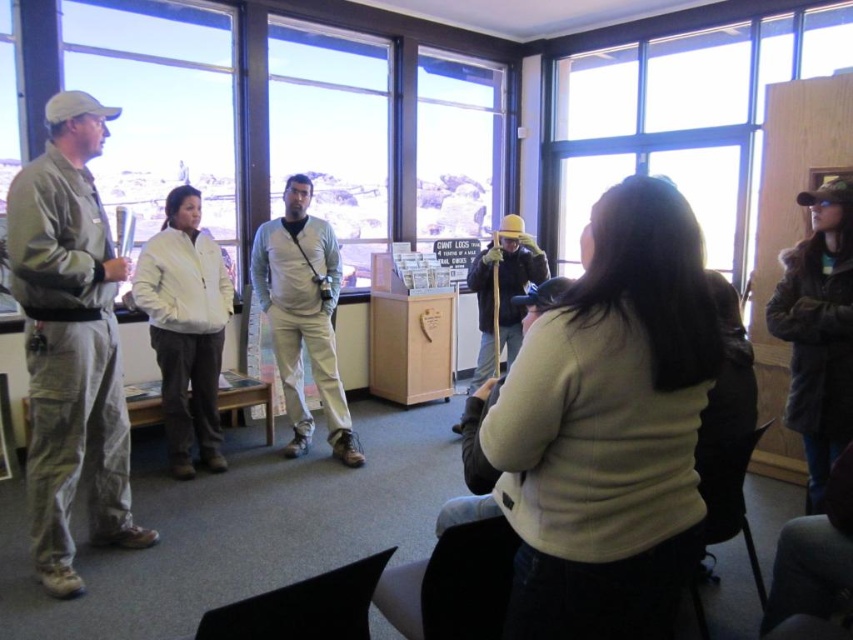
You are a person who is 1.8 meters tall and want to walk from the light beige sweater at center to the brown fuzzy coat at right. Can you walk directly between them without bending down?

The distance between the light beige sweater at center and the brown fuzzy coat at right is 1.76 meters. Since you are 1.8 meters tall, you would need to bend slightly to navigate the space between them.

You are an interior designer planning to hang a new picture frame that requires a sturdy surface. Based on the scene, which object between the transparent glass window at center and the wooden stick at center would be more suitable for hanging the frame?

The wooden stick at center would be more suitable for hanging the frame because the transparent glass window at center is located above it, implying the wooden stick is a structure like a wall or beam that can support weight, whereas glass windows are not typically sturdy for hanging items.

You are a person who is 5 feet tall. You want to walk from the brown fuzzy coat at right to the light gray cotton shirt at center. Is there enough space for you to walk through the area between them?

The distance between the brown fuzzy coat at right and the light gray cotton shirt at center is 7.84 feet, so yes, there is enough space for a 5 feet tall person to walk through the area between them.